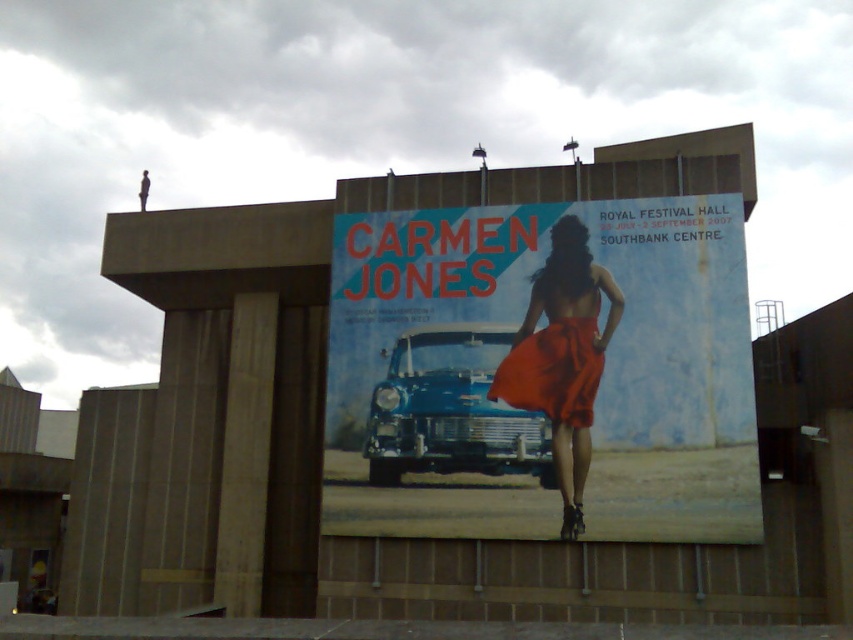
Is matte red fabric at center behind satin red dress at center?

No, matte red fabric at center is closer to the viewer.

Which of these two, matte red fabric at center or satin red dress at center, stands taller?

matte red fabric at center

Is point (498, 465) farther from camera compared to point (602, 273)?

No.

This screenshot has height=640, width=853. I want to click on matte red fabric at center, so click(x=543, y=369).

Does matte red fabric at center have a smaller size compared to matte orange fabric dress at center?

No.

Based on the photo, is matte red fabric at center thinner than matte orange fabric dress at center?

Incorrect, matte red fabric at center's width is not less than matte orange fabric dress at center's.

What do you see at coordinates (543, 369) in the screenshot?
I see `matte red fabric at center` at bounding box center [543, 369].

Locate an element on the screen. matte red fabric at center is located at coordinates (543, 369).

Which of these two, satin red dress at center or matte orange fabric dress at center, stands taller?

satin red dress at center is taller.

Can you confirm if satin red dress at center is positioned above matte orange fabric dress at center?

No, satin red dress at center is not above matte orange fabric dress at center.

Is point (509, 387) positioned before point (508, 387)?

Yes, it is in front of point (508, 387).

What are the coordinates of `satin red dress at center` in the screenshot? It's located at (561, 356).